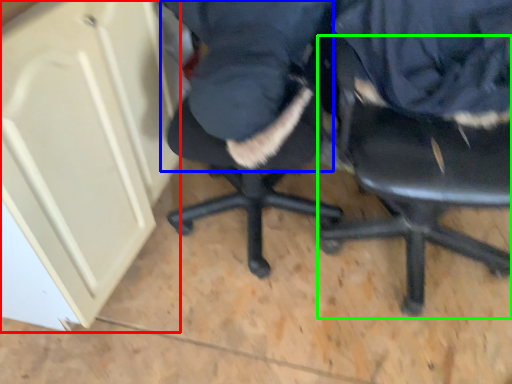
Question: Considering the real-world distances, which object is closest to cabinetry (highlighted by a red box)? clothing (highlighted by a blue box) or chair (highlighted by a green box).

Choices:
 (A) clothing
 (B) chair

Answer: (A)